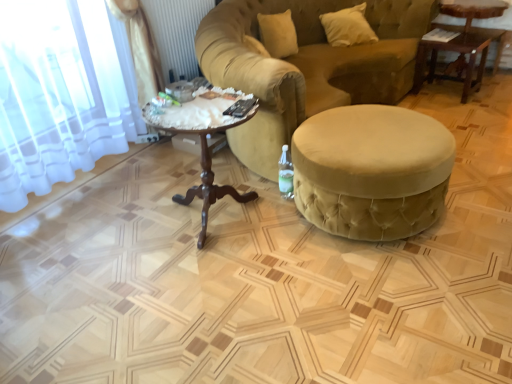
I want to click on vacant space behind mahogany wood coffee table at center, so click(195, 171).